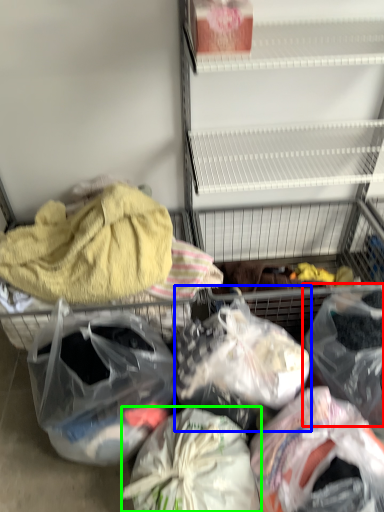
Question: Considering the real-world distances, which object is closest to plastic bag (highlighted by a red box)? plastic bag (highlighted by a blue box) or plastic bag (highlighted by a green box).

Choices:
 (A) plastic bag
 (B) plastic bag

Answer: (A)